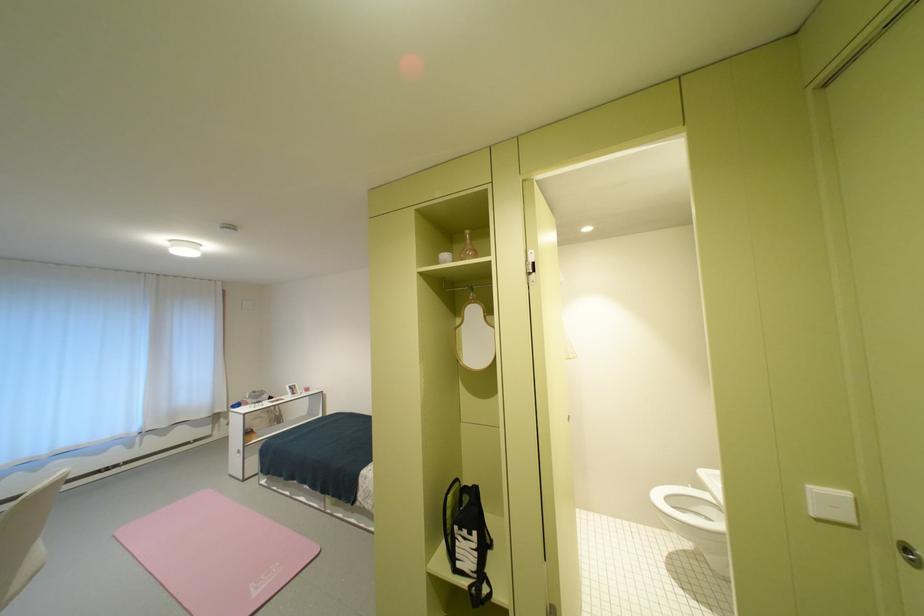
Image resolution: width=924 pixels, height=616 pixels. Describe the element at coordinates (464, 278) in the screenshot. I see `the closet rod` at that location.